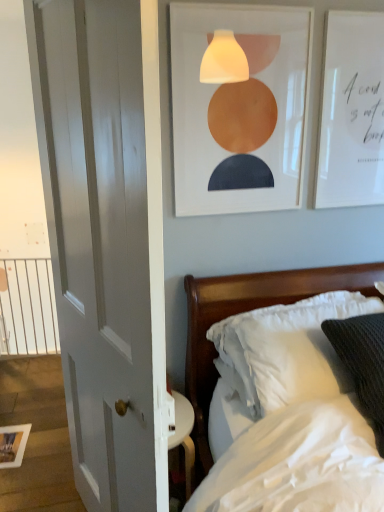
Question: Considering their positions, is white metal balustrade at left located in front of or behind wooden picture frame at lower left, which ranks as the third picture frame in top-to-bottom order?

Choices:
 (A) front
 (B) behind

Answer: (B)

Question: Is white metal balustrade at left inside the boundaries of wooden picture frame at lower left, which appears as the first picture frame when viewed from the left, or outside?

Choices:
 (A) inside
 (B) outside

Answer: (B)

Question: Which is nearer to the wooden picture frame at lower left, which appears as the first picture frame when viewed from the left?

Choices:
 (A) white matte picture frame at upper center, placed as the second picture frame when sorted from bottom to top
 (B) white smooth door at left
 (C) white paper at upper right, arranged as the 3th picture frame when viewed from the left
 (D) white metal balustrade at left
 (E) white soft pillow at lower right

Answer: (D)

Question: Which object is the closest to the white matte picture frame at upper center, the 2th picture frame from the left?

Choices:
 (A) white soft pillow at lower right
 (B) wooden picture frame at lower left, which ranks as the first picture frame in back-to-front order
 (C) white metal balustrade at left
 (D) white smooth door at left
 (E) wooden bed at right

Answer: (E)